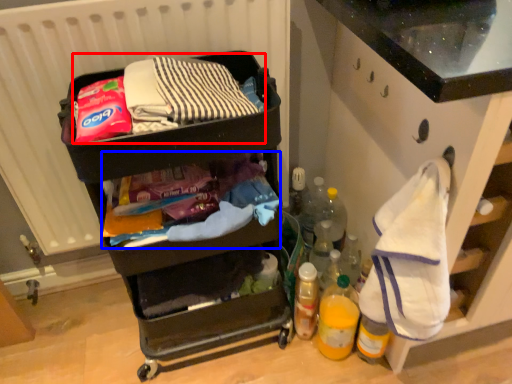
Question: Which point is further to the camera, waste (highlighted by a red box) or waste (highlighted by a blue box)?

Choices:
 (A) waste
 (B) waste

Answer: (B)